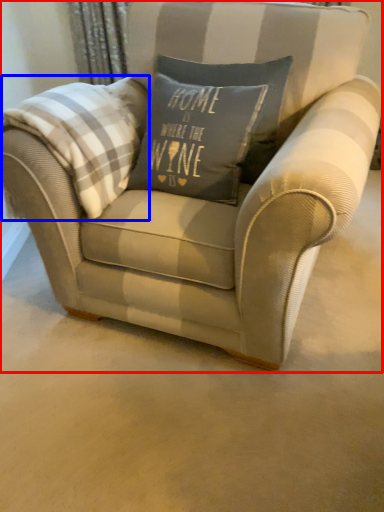
Question: Which object appears closest to the camera in this image, chair (highlighted by a red box) or plaid (highlighted by a blue box)?

Choices:
 (A) chair
 (B) plaid

Answer: (A)